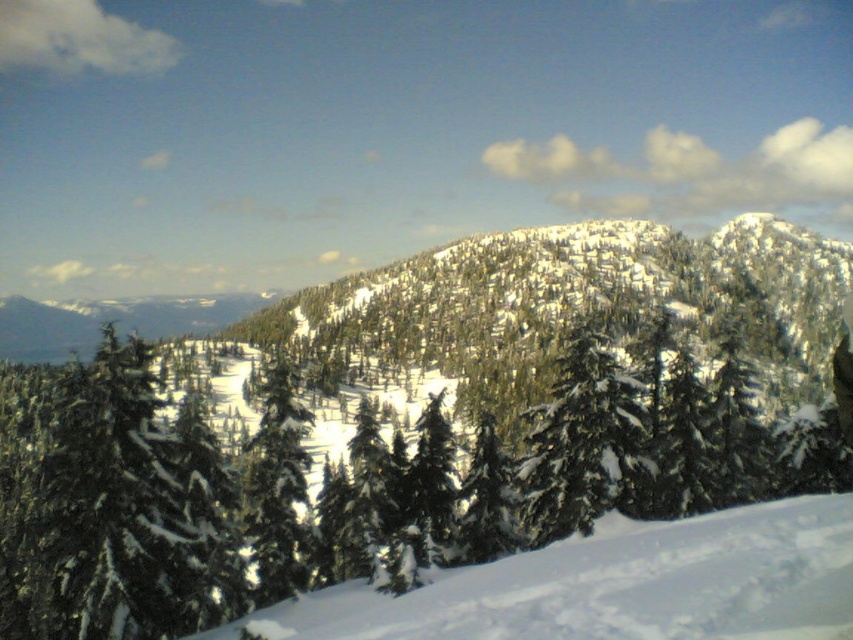
Based on the photo, you are standing in the winter landscape and want to take a photo of the green textured pine tree at left and the white snow at lower right. Which object is closer to you based on their positions?

The green textured pine tree at left is positioned under white snow at lower right, meaning the white snow at lower right is closer to you.

You are standing in the winter landscape and want to take a photo of the green textured pine tree at left and the white snow at lower right. Which object will appear larger in your photo?

The green textured pine tree at left will appear larger in the photo because it is taller than the white snow at lower right.

You are standing at the bottom of the slope looking towards the green matte tree at center and the white snow at lower right. Which object is higher in elevation?

The green matte tree at center is above the white snow at lower right, so it is higher in elevation.